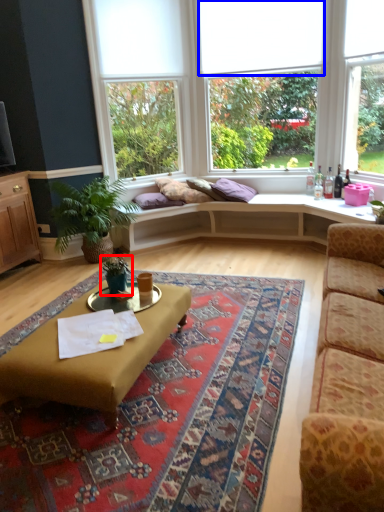
Question: Which point is further to the camera, houseplant (highlighted by a red box) or blind (highlighted by a blue box)?

Choices:
 (A) houseplant
 (B) blind

Answer: (B)